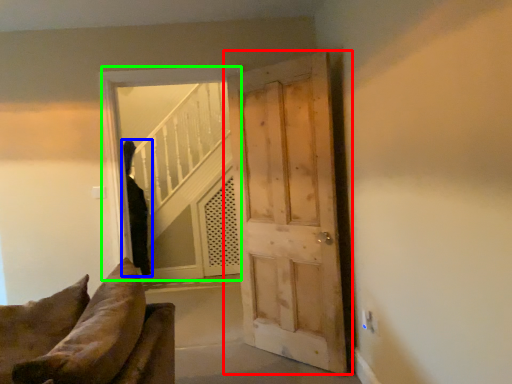
Question: Based on their relative distances, which object is nearer to door (highlighted by a red box)? Choose from person (highlighted by a blue box) and window (highlighted by a green box).

Choices:
 (A) person
 (B) window

Answer: (B)